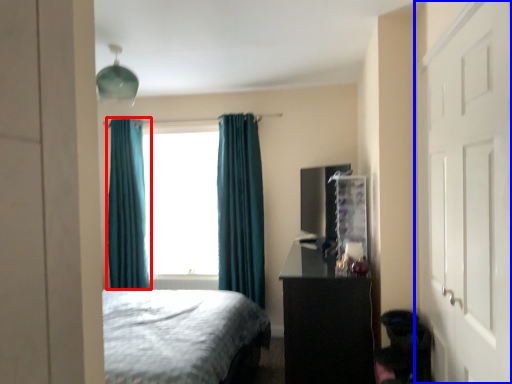
Question: Which point is closer to the camera, curtain (highlighted by a red box) or door (highlighted by a blue box)?

Choices:
 (A) curtain
 (B) door

Answer: (B)